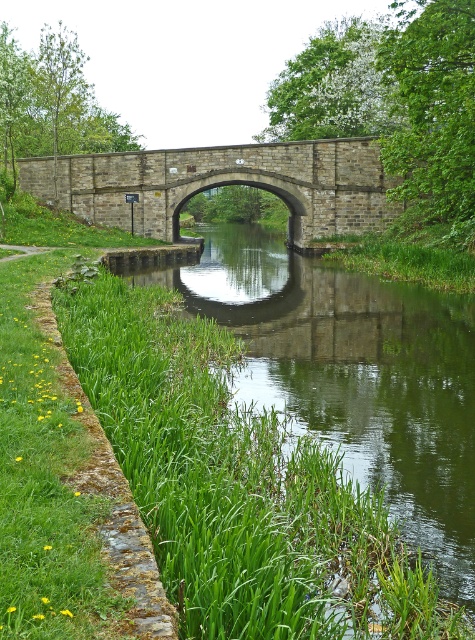
You are standing at the camera position and want to cross the canal to the green grassy stream at lower left. The bridge is 20 feet long. Can you reach the stream by walking across the bridge?

The distance between you and the green grassy stream at lower left is 22.51 feet, while the bridge is only 20 feet long. Therefore, the bridge is not long enough to reach the stream.

You are standing at the edge of the green grassy stream at lower left and want to cross to the brown stone bridge at center. Which direction should you head to reach the bridge?

You should head to the left because the green grassy stream at lower left is to the right of the brown stone bridge at center, so moving left will take you towards the bridge.